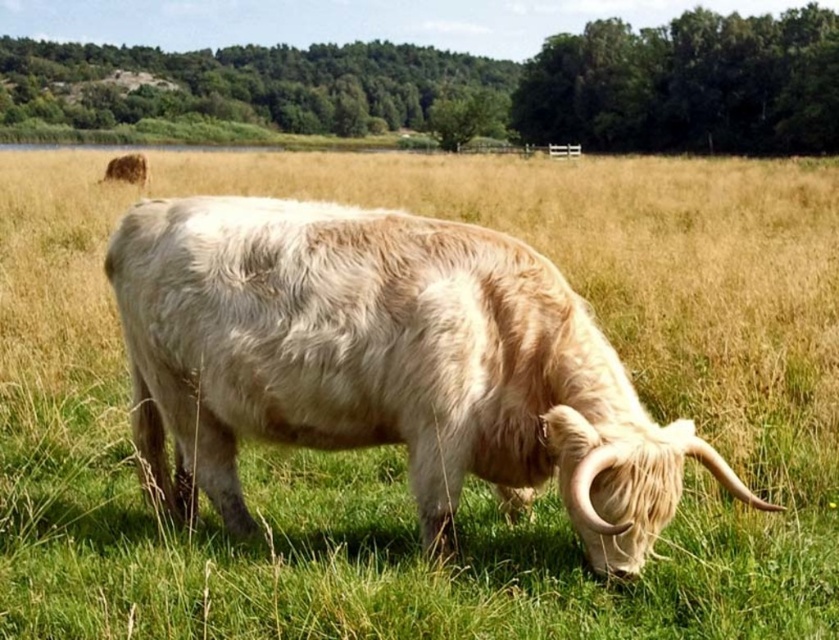
Who is positioned more to the right, white woolly bull at center or fuzzy brown yak at upper left?

white woolly bull at center

Based on the photo, does white woolly bull at center come behind fuzzy brown yak at upper left?

No, it is not.

The height and width of the screenshot is (640, 839). I want to click on white woolly bull at center, so click(x=386, y=364).

Find the location of `white woolly bull at center`. white woolly bull at center is located at coordinates (386, 364).